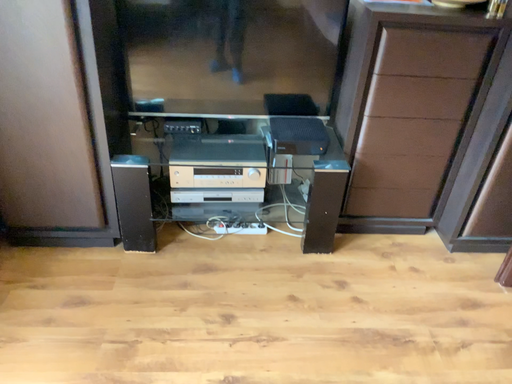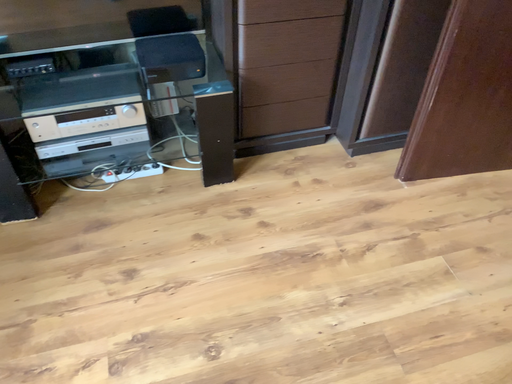
Question: How did the camera likely rotate when shooting the video?

Choices:
 (A) rotated downward
 (B) rotated upward

Answer: (A)